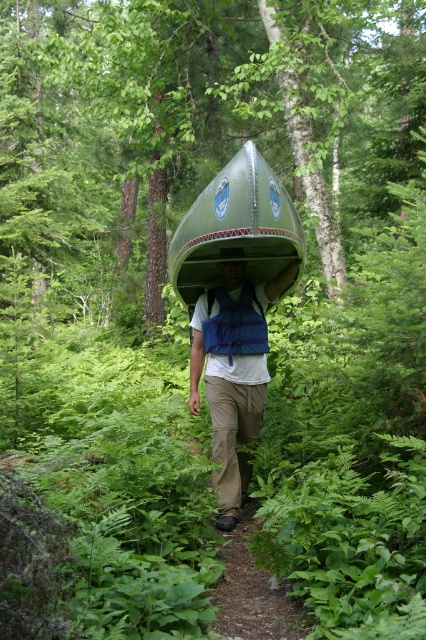
Question: Can you confirm if brown dirt path at center is positioned below matte blue helmet at center?

Choices:
 (A) yes
 (B) no

Answer: (A)

Question: Which point appears closest to the camera in this image?

Choices:
 (A) (232, 253)
 (B) (233, 404)
 (C) (229, 556)
 (D) (210, 305)

Answer: (C)

Question: Which point is closer to the camera taking this photo?

Choices:
 (A) (239, 250)
 (B) (227, 365)

Answer: (B)

Question: Can you confirm if matte green canoe at center is bigger than blue fabric strap at center?

Choices:
 (A) yes
 (B) no

Answer: (A)

Question: Is brown dirt path at center wider than blue fabric strap at center?

Choices:
 (A) yes
 (B) no

Answer: (A)

Question: Considering the real-world distances, which object is farthest from the khaki cotton pants at center?

Choices:
 (A) green matte canoe at center
 (B) brown dirt path at center

Answer: (A)